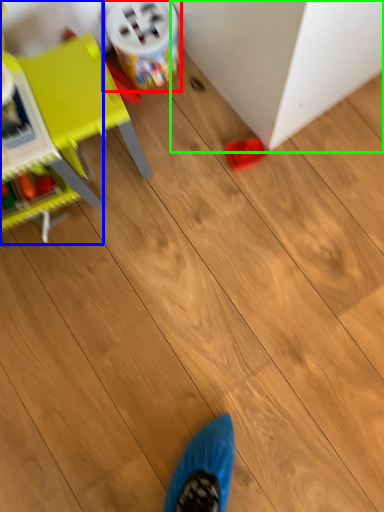
Question: Based on their relative distances, which object is farther from toy (highlighted by a red box)? Choose from toy (highlighted by a blue box) and furniture (highlighted by a green box).

Choices:
 (A) toy
 (B) furniture

Answer: (A)